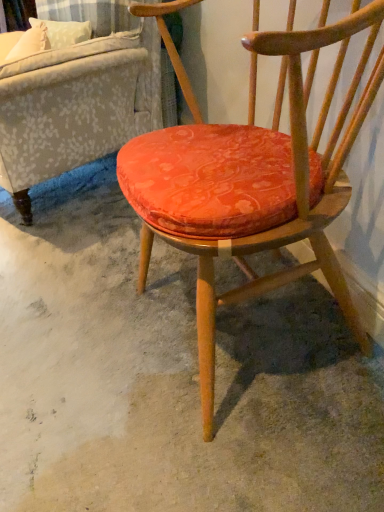
Question: From a real-world perspective, is velvet orange cushion at center below textured gray fabric couch at upper left?

Choices:
 (A) no
 (B) yes

Answer: (A)

Question: Is velvet orange cushion at center not within textured gray fabric couch at upper left?

Choices:
 (A) yes
 (B) no

Answer: (A)

Question: Does velvet orange cushion at center have a greater width compared to textured gray fabric couch at upper left?

Choices:
 (A) yes
 (B) no

Answer: (B)

Question: Can you see velvet orange cushion at center touching textured gray fabric couch at upper left?

Choices:
 (A) yes
 (B) no

Answer: (B)

Question: Is textured gray fabric couch at upper left surrounded by velvet orange cushion at center?

Choices:
 (A) no
 (B) yes

Answer: (A)

Question: Relative to textured gray fabric couch at upper left, is orange fabric cushion at center in front or behind?

Choices:
 (A) behind
 (B) front

Answer: (B)

Question: From the image's perspective, is orange fabric cushion at center located above or below textured gray fabric couch at upper left?

Choices:
 (A) above
 (B) below

Answer: (B)

Question: Does point (44, 283) appear closer or farther from the camera than point (125, 10)?

Choices:
 (A) closer
 (B) farther

Answer: (A)

Question: Is orange fabric cushion at center spatially inside textured gray fabric couch at upper left, or outside of it?

Choices:
 (A) inside
 (B) outside

Answer: (B)

Question: From the image's perspective, is textured gray fabric couch at upper left above or below orange fabric cushion at center?

Choices:
 (A) below
 (B) above

Answer: (B)

Question: From their relative heights in the image, would you say textured gray fabric couch at upper left is taller or shorter than orange fabric cushion at center?

Choices:
 (A) short
 (B) tall

Answer: (B)

Question: Is point (155, 61) positioned closer to the camera than point (51, 305)?

Choices:
 (A) farther
 (B) closer

Answer: (A)

Question: Considering the positions of textured gray fabric couch at upper left and orange fabric cushion at center in the image, is textured gray fabric couch at upper left bigger or smaller than orange fabric cushion at center?

Choices:
 (A) small
 (B) big

Answer: (B)

Question: Looking at their shapes, would you say orange fabric cushion at center is wider or thinner than velvet orange cushion at center?

Choices:
 (A) wide
 (B) thin

Answer: (A)

Question: From a real-world perspective, is orange fabric cushion at center positioned above or below velvet orange cushion at center?

Choices:
 (A) above
 (B) below

Answer: (B)